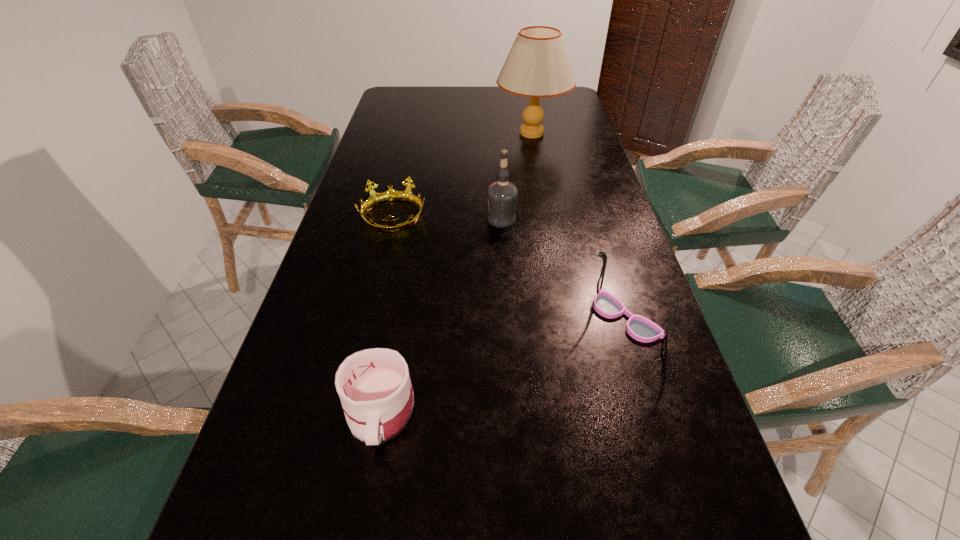
Find the location of a particular element. vacant region between the spectacles and the farthest object is located at coordinates (579, 225).

Image resolution: width=960 pixels, height=540 pixels. What are the coordinates of `free space between the second shortest object and the shortest object` in the screenshot? It's located at (387, 314).

At what (x,y) coordinates should I click in order to perform the action: click on free area in between the third shortest object and the second tallest object. Please return your answer as a coordinate pair (x, y). Looking at the image, I should click on (564, 268).

Image resolution: width=960 pixels, height=540 pixels. What are the coordinates of `object that ranks as the third closest to the vodka` in the screenshot? It's located at (537, 66).

Identify which object is the second closest to the vodka. Please provide its 2D coordinates. Your answer should be formatted as a tuple, i.e. [(x, y)], where the tuple contains the x and y coordinates of a point satisfying the conditions above.

[(640, 328)]

Identify the location of free location that satisfies the following two spatial constraints: 1. on the front label of the vodka; 2. on the side with the handle of the mug. (513, 412).

At what (x,y) coordinates should I click in order to perform the action: click on free spot that satisfies the following two spatial constraints: 1. on the front label of the second tallest object; 2. on the side with the handle of the nearest object. Please return your answer as a coordinate pair (x, y). This screenshot has width=960, height=540. Looking at the image, I should click on (513, 412).

Find the location of `free point that satisfies the following two spatial constraints: 1. on the front label of the second tallest object; 2. on the right side of the third tallest object`. free point that satisfies the following two spatial constraints: 1. on the front label of the second tallest object; 2. on the right side of the third tallest object is located at coordinates (507, 317).

Locate an element on the screen. vacant space that satisfies the following two spatial constraints: 1. on the front side of the third shortest object; 2. on the left side of the shortest object is located at coordinates (371, 317).